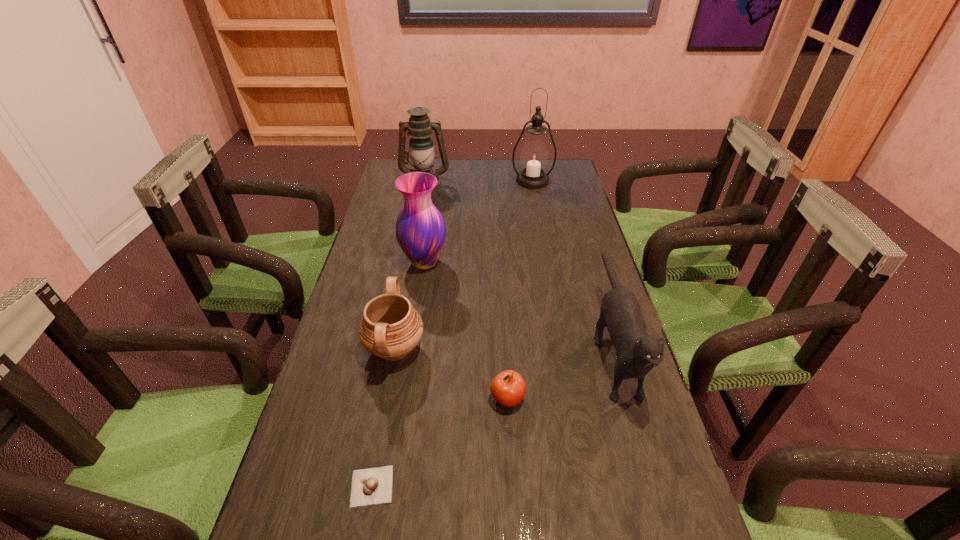
Where is `free area in between the fifth tallest object and the tallest object`? free area in between the fifth tallest object and the tallest object is located at coordinates (464, 265).

Where is `free space between the urn and the taller oil lamp`? This screenshot has width=960, height=540. free space between the urn and the taller oil lamp is located at coordinates (464, 265).

Locate an element on the screen. vacant space that's between the sixth tallest object and the cat is located at coordinates (560, 373).

Identify the location of free area in between the cat and the taller oil lamp. The image size is (960, 540). (572, 264).

You are a GUI agent. You are given a task and a screenshot of the screen. Output one action in this format:
    pyautogui.click(x=<x>, y=<y>)
    Task: Click on the empty space between the shortest object and the fifth tallest object
    
    Given the screenshot: What is the action you would take?
    pyautogui.click(x=383, y=417)

I want to click on unoccupied area between the taller oil lamp and the third shortest object, so click(464, 265).

Identify the location of object identified as the third closest to the fourth shortest object. (390, 328).

This screenshot has width=960, height=540. What are the coordinates of `object that is the fourth closest to the tallest object` in the screenshot? It's located at (390, 328).